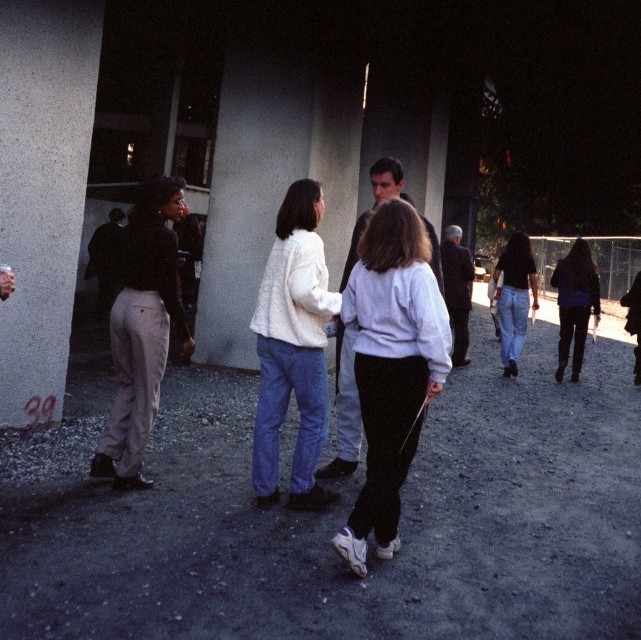
Question: Does smooth gray sweater at center have a larger size compared to jeans at right?

Choices:
 (A) no
 (B) yes

Answer: (B)

Question: Is smooth gray sweater at center smaller than jeans at right?

Choices:
 (A) no
 (B) yes

Answer: (A)

Question: Is smooth gray sweater at center to the left of jeans at right from the viewer's perspective?

Choices:
 (A) no
 (B) yes

Answer: (B)

Question: Estimate the real-world distances between objects in this image. Which object is closer to the matte black pants at left?

Choices:
 (A) white sweater at center
 (B) dark gray suit at center
 (C) jeans at right
 (D) dark purple sweater at right

Answer: (A)

Question: Based on their relative distances, which object is nearer to the white sweater at center?

Choices:
 (A) jeans at right
 (B) dark gray suit at center

Answer: (B)

Question: Which object is farther from the camera taking this photo?

Choices:
 (A) matte black pants at left
 (B) dark gray suit at center

Answer: (B)